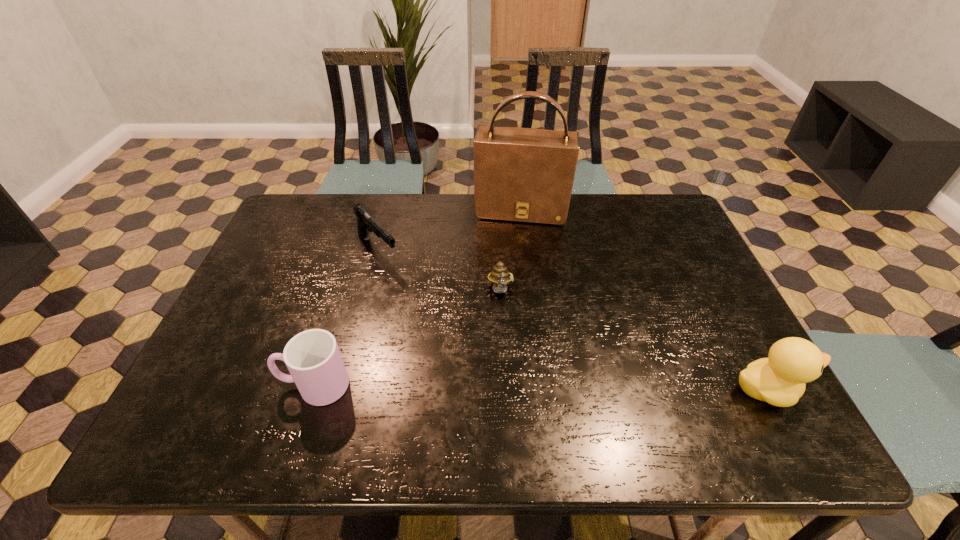
You are a GUI agent. You are given a task and a screenshot of the screen. Output one action in this format:
    pyautogui.click(x=<x>, y=<y>)
    Task: Click on the vacant space on the desktop that is between the cup and the rightmost object and is positioned at the aiming end of the fourth nearest object
    The height and width of the screenshot is (540, 960).
    Given the screenshot: What is the action you would take?
    pyautogui.click(x=506, y=387)

This screenshot has width=960, height=540. I want to click on vacant space on the desktop that is between the cup and the duck and is positioned on the front flap of the shoulder bag, so click(x=501, y=387).

Find the location of `vacant space on the desktop that is between the cup and the rightmost object and is positioned on the face of the third farthest object`. vacant space on the desktop that is between the cup and the rightmost object and is positioned on the face of the third farthest object is located at coordinates (509, 387).